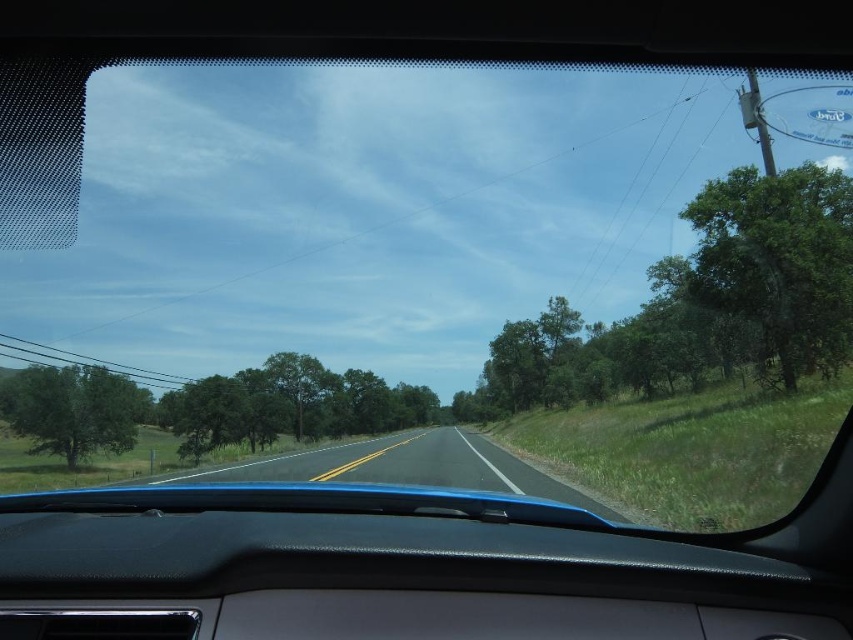
You are driving a car and need to stay on the asphalt road at center. There is a green leafy tree at left near the road. From the driver seat perspective, which side of the tree is the road located?

The asphalt road at center is to the right of the green leafy tree at left.

You are driving a car and want to know if the green leafy tree at right is blocking your view of the road ahead. Based on the scene, can you determine if the tree is positioned in a way that could obstruct your view of the asphalt road at center?

The green leafy tree at right is located above asphalt road at center, so it might block your view of the road ahead since it is positioned above the road.

Consider the image. You are a driver approaching a curve on the road. You see the asphalt road at center and the green leafy tree at left. Which object is taller from your perspective?

The green leafy tree at left is taller than the asphalt road at center.